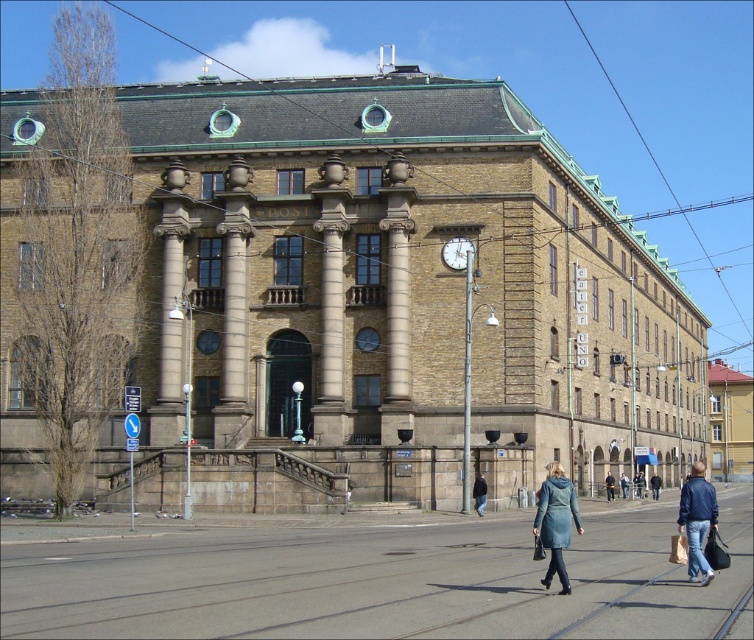
You are standing at the base of the historic building and see the teal fabric coat at lower center and the brass metallic clock at center. Which object is positioned to the right when viewed from your perspective?

The teal fabric coat at lower center is to the right of the brass metallic clock at center.